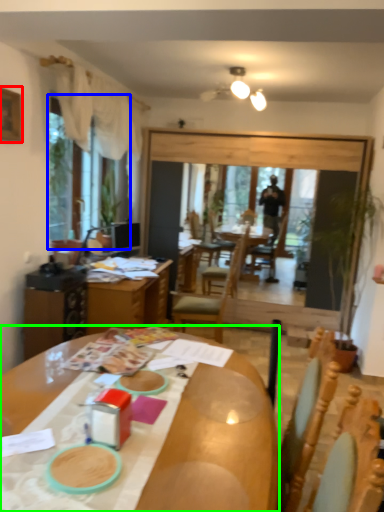
Question: Considering the real-world distances, which object is farthest from picture frame (highlighted by a red box)? window screen (highlighted by a blue box) or desk (highlighted by a green box)?

Choices:
 (A) window screen
 (B) desk

Answer: (B)